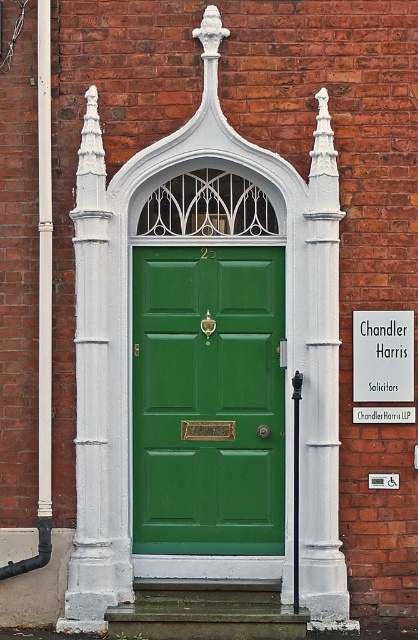
Question: From the image, what is the correct spatial relationship of white painted stone column at left in relation to white painted stone pillar at center?

Choices:
 (A) below
 (B) above

Answer: (B)

Question: Among these points, which one is farthest from the camera?

Choices:
 (A) pyautogui.click(x=316, y=268)
 (B) pyautogui.click(x=204, y=339)

Answer: (B)

Question: Which object is the closest to the white painted stone column at left?

Choices:
 (A) white painted stone pillar at center
 (B) green matte door at center

Answer: (B)

Question: Which is farther from the white painted stone column at left?

Choices:
 (A) green matte door at center
 (B) white painted stone pillar at center

Answer: (B)

Question: Is green matte door at center above white painted stone pillar at center?

Choices:
 (A) no
 (B) yes

Answer: (A)

Question: Does green matte door at center have a larger size compared to white painted stone pillar at center?

Choices:
 (A) yes
 (B) no

Answer: (A)